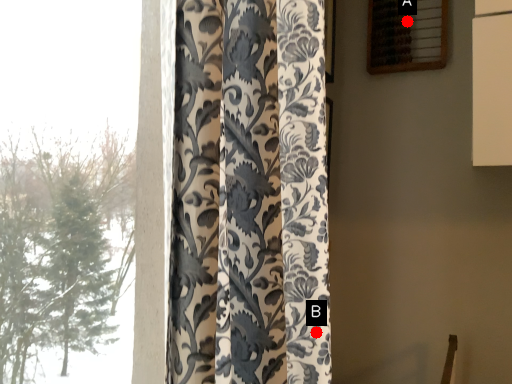
Question: Two points are circled on the image, labeled by A and B beside each circle. Which point is farther to the camera?

Choices:
 (A) A is further
 (B) B is further

Answer: (A)